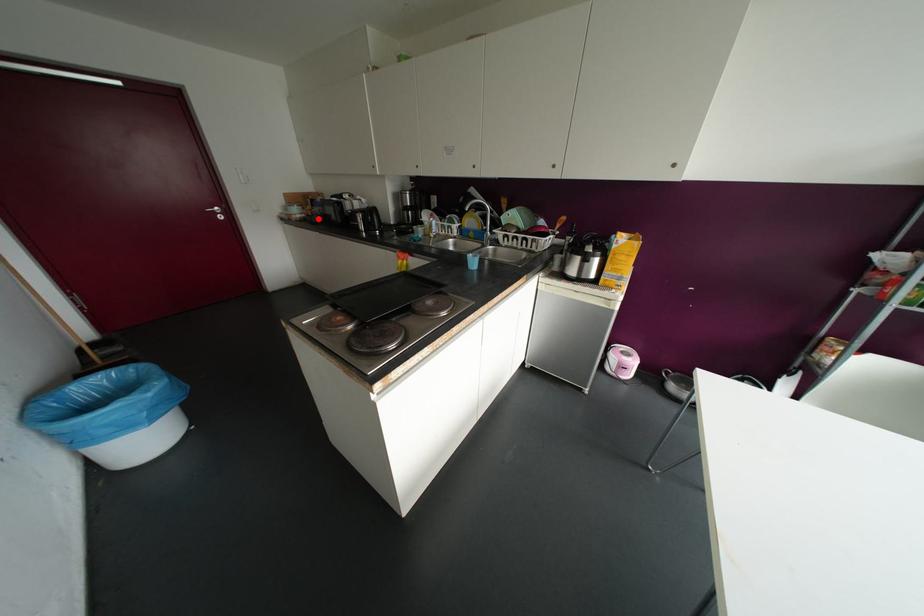
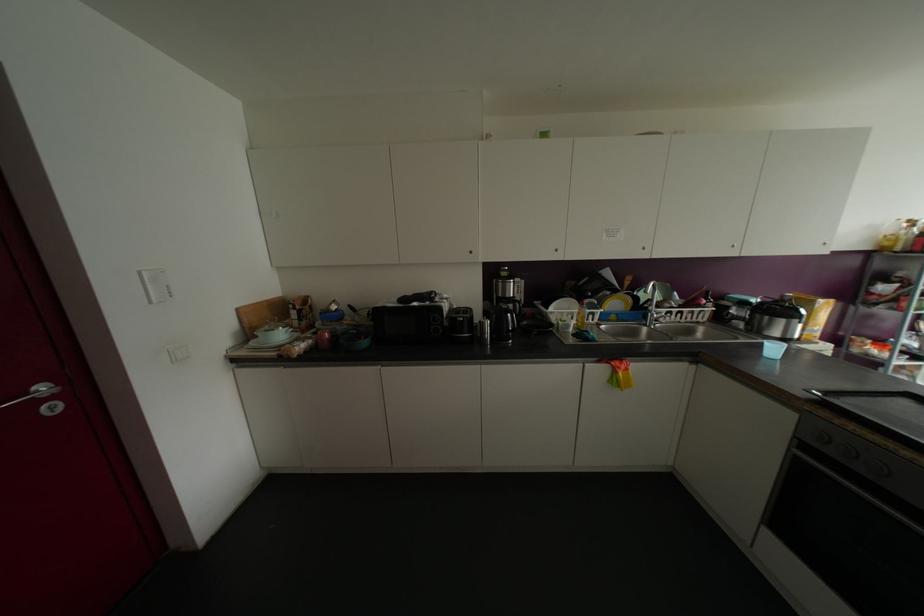
Question: I am providing you with two images of the same scene from different viewpoints. Image1 has a red point marked. In image2, the corresponding 3D location appears at what relative position? Reply with the corresponding letter.

Choices:
 (A) Closer
 (B) Farther

Answer: (B)